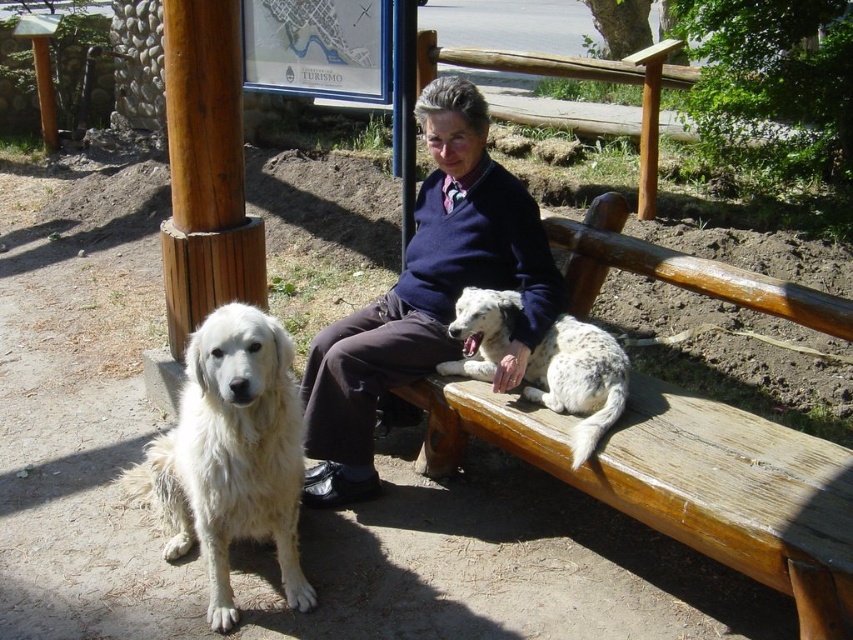
Can you confirm if wooden bench at center is positioned to the left of white fluffy dog at left?

Incorrect, wooden bench at center is not on the left side of white fluffy dog at left.

Does point (612, 236) lie behind point (165, 545)?

Yes, it is behind point (165, 545).

Which is in front, point (636, 476) or point (207, 340)?

Point (207, 340) is in front.

This screenshot has width=853, height=640. Identify the location of wooden bench at center. [688, 483].

Which is behind, point (375, 301) or point (229, 408)?

Positioned behind is point (375, 301).

Does dark blue sweater at center have a lesser height compared to white fluffy dog at left?

In fact, dark blue sweater at center may be taller than white fluffy dog at left.

The height and width of the screenshot is (640, 853). What do you see at coordinates (427, 296) in the screenshot? I see `dark blue sweater at center` at bounding box center [427, 296].

Identify the location of dark blue sweater at center. The height and width of the screenshot is (640, 853). (427, 296).

Can you confirm if wooden bench at center is positioned to the left of spotted fur dog at bench center?

In fact, wooden bench at center is to the right of spotted fur dog at bench center.

From the picture: Is wooden bench at center to the right of spotted fur dog at bench center from the viewer's perspective?

Indeed, wooden bench at center is positioned on the right side of spotted fur dog at bench center.

Between point (694, 541) and point (589, 429), which one is positioned in front?

Positioned in front is point (694, 541).

Locate an element on the screen. The height and width of the screenshot is (640, 853). wooden bench at center is located at coordinates (688, 483).